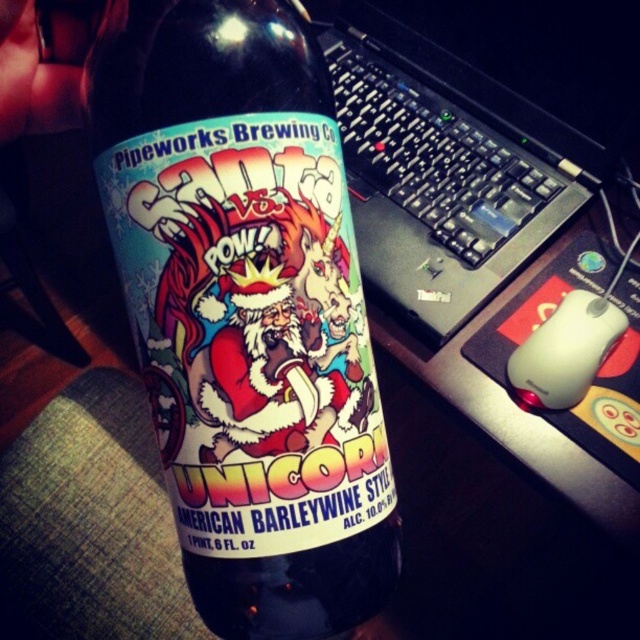
This screenshot has width=640, height=640. Describe the element at coordinates (243, 301) in the screenshot. I see `glossy glass bottle at center` at that location.

Can you confirm if glossy glass bottle at center is positioned to the right of white matte mouse at lower right?

In fact, glossy glass bottle at center is to the left of white matte mouse at lower right.

Locate an element on the screen. The width and height of the screenshot is (640, 640). glossy glass bottle at center is located at coordinates (243, 301).

Between point (435, 184) and point (570, 300), which one is positioned behind?

Positioned behind is point (435, 184).

This screenshot has width=640, height=640. What do you see at coordinates (433, 152) in the screenshot? I see `black plastic keyboard at upper center` at bounding box center [433, 152].

You are a GUI agent. You are given a task and a screenshot of the screen. Output one action in this format:
    pyautogui.click(x=<x>, y=<y>)
    Task: Click on the black plastic keyboard at upper center
    
    Given the screenshot: What is the action you would take?
    pyautogui.click(x=433, y=152)

Does glossy glass bottle at center have a greater height compared to black plastic keyboard at upper center?

Incorrect, glossy glass bottle at center's height is not larger of black plastic keyboard at upper center's.

Does glossy glass bottle at center appear over black plastic keyboard at upper center?

No, glossy glass bottle at center is not above black plastic keyboard at upper center.

This screenshot has height=640, width=640. Identify the location of glossy glass bottle at center. (243, 301).

I want to click on glossy glass bottle at center, so click(x=243, y=301).